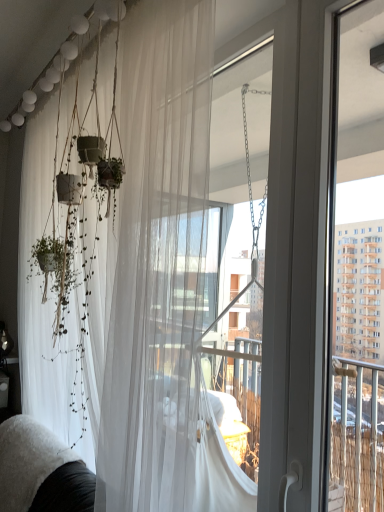
Question: From the image's perspective, is white fluffy couch at lower left above or below translucent white curtain at left?

Choices:
 (A) below
 (B) above

Answer: (A)

Question: Considering the positions of white fluffy couch at lower left and translucent white curtain at left in the image, is white fluffy couch at lower left bigger or smaller than translucent white curtain at left?

Choices:
 (A) small
 (B) big

Answer: (A)

Question: In the image, is white fluffy couch at lower left positioned in front of or behind translucent white curtain at left?

Choices:
 (A) front
 (B) behind

Answer: (B)

Question: Is point (62, 93) closer or farther from the camera than point (61, 457)?

Choices:
 (A) farther
 (B) closer

Answer: (A)

Question: In terms of size, does translucent white curtain at left appear bigger or smaller than white fluffy couch at lower left?

Choices:
 (A) big
 (B) small

Answer: (A)

Question: Considering their positions, is translucent white curtain at left located in front of or behind white fluffy couch at lower left?

Choices:
 (A) behind
 (B) front

Answer: (B)

Question: From a real-world perspective, is translucent white curtain at left positioned above or below white fluffy couch at lower left?

Choices:
 (A) above
 (B) below

Answer: (A)